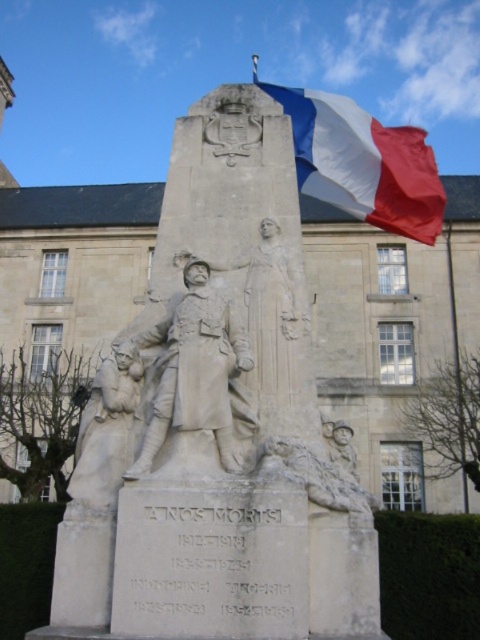
Who is positioned more to the left, white marble monument at center or white marble statue at lower left?

white marble statue at lower left is more to the left.

Who is positioned more to the right, white marble monument at center or white marble statue at lower left?

white marble monument at center

Is point (149, 452) less distant than point (101, 432)?

Yes, point (149, 452) is in front of point (101, 432).

In order to click on white marble monument at center in this screenshot , I will do `click(217, 422)`.

Who is more forward, (70,486) or (231,326)?

Point (70,486) is more forward.

Between white marble monument at center and white stone soldier at center, which one has more height?

Standing taller between the two is white marble monument at center.

Is point (205, 115) in front of point (201, 369)?

That is False.

You are a GUI agent. You are given a task and a screenshot of the screen. Output one action in this format:
    pyautogui.click(x=<x>, y=<y>)
    Task: Click on the white marble monument at center
    
    Given the screenshot: What is the action you would take?
    pyautogui.click(x=217, y=422)

Based on the photo, who is more distant from viewer, (132, 476) or (96, 460)?

Point (96, 460)

Can you confirm if white stone soldier at center is bigger than white marble statue at lower left?

Incorrect, white stone soldier at center is not larger than white marble statue at lower left.

Where is `white stone soldier at center`? The image size is (480, 640). white stone soldier at center is located at coordinates (196, 371).

Locate an element on the screen. The width and height of the screenshot is (480, 640). white stone soldier at center is located at coordinates (196, 371).